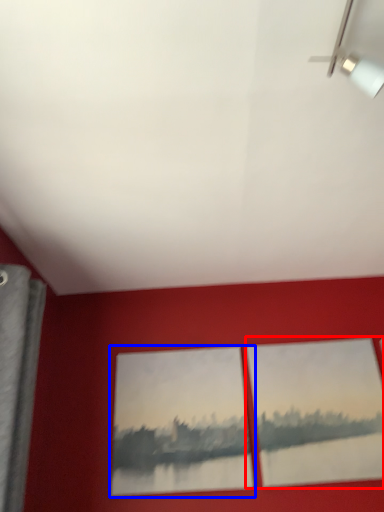
Question: Which object is closer to the camera taking this photo, picture frame (highlighted by a red box) or picture frame (highlighted by a blue box)?

Choices:
 (A) picture frame
 (B) picture frame

Answer: (A)